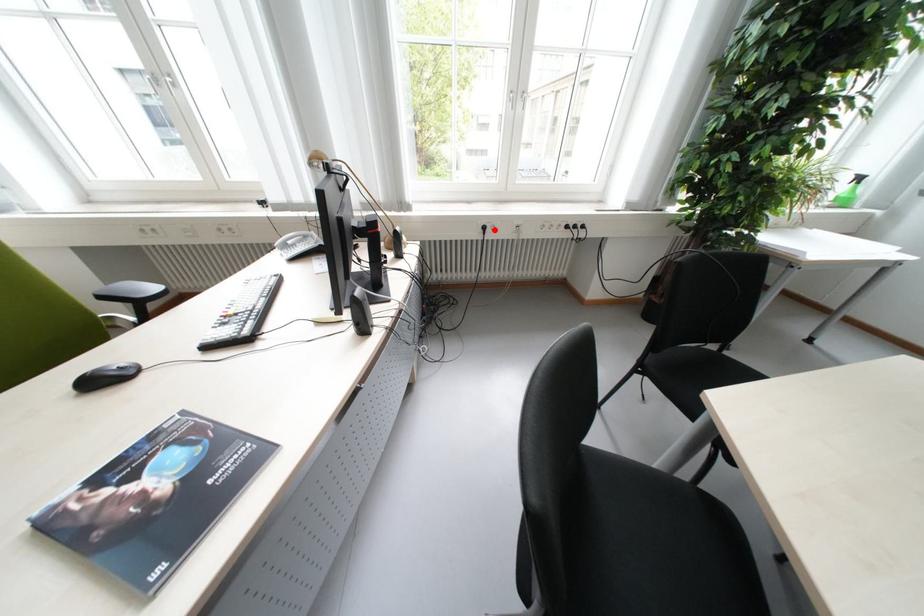
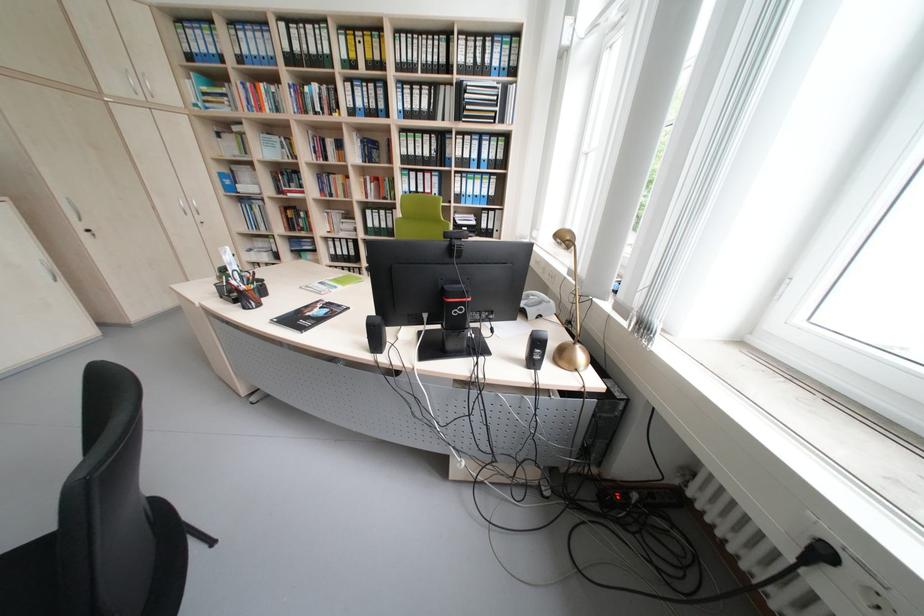
Question: I am providing you with two images of the same scene from different viewpoints. A red point is shown in image1. For the corresponding object point in image2, is it positioned nearer or farther from the camera?

Choices:
 (A) Nearer
 (B) Farther

Answer: (B)